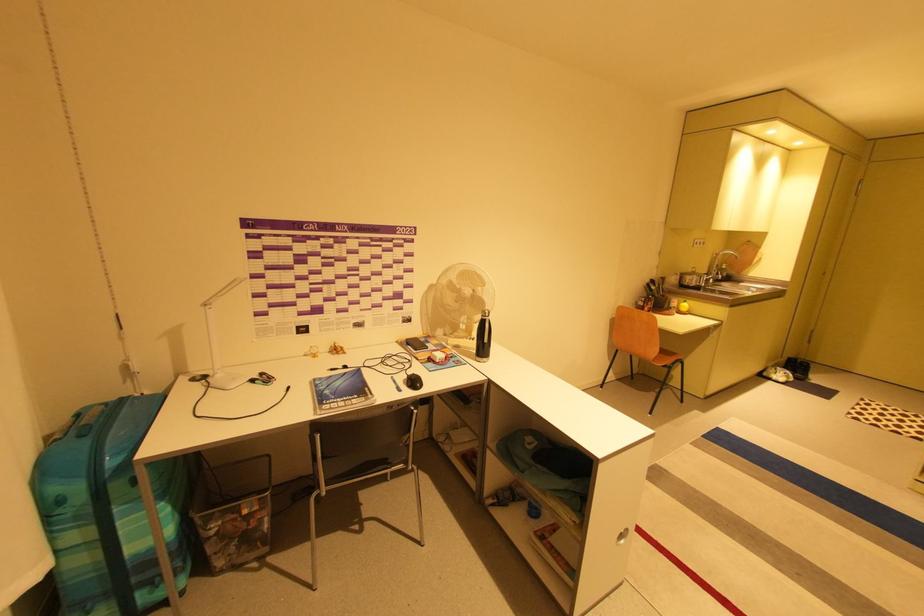
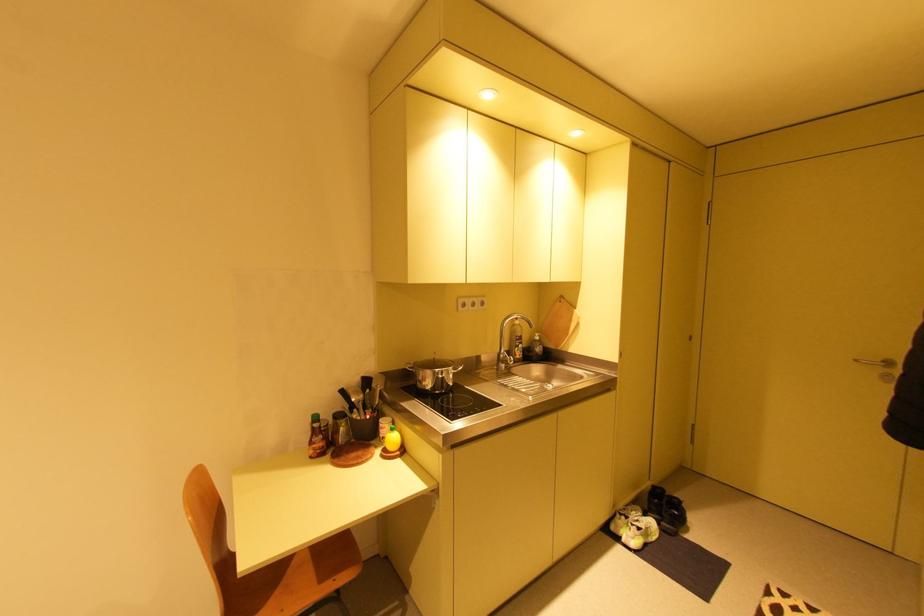
Where in the second image is the point corresponding to (795,359) from the first image?

(660, 487)